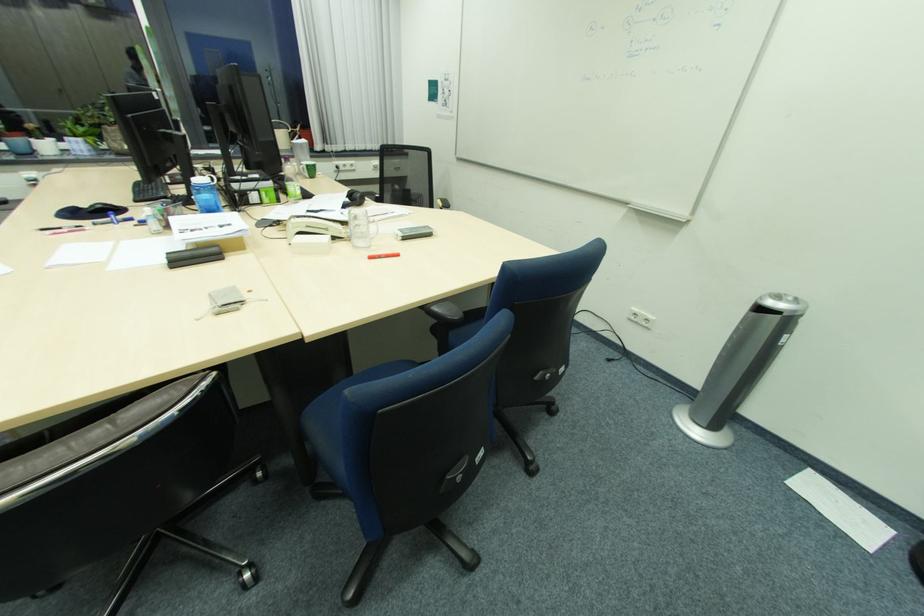
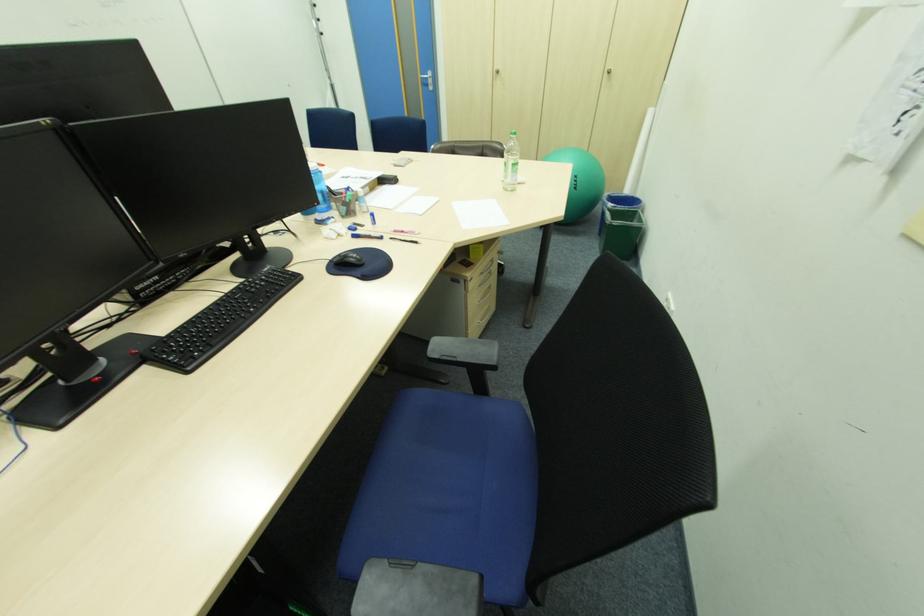
Question: I am providing you with two images of the same scene from different viewpoints. Which of the following objects are not visible in image2?

Choices:
 (A) drawer handle
 (B) blue water bottle
 (C) blue backpack strap
 (D) blue chair armrest

Answer: (D)